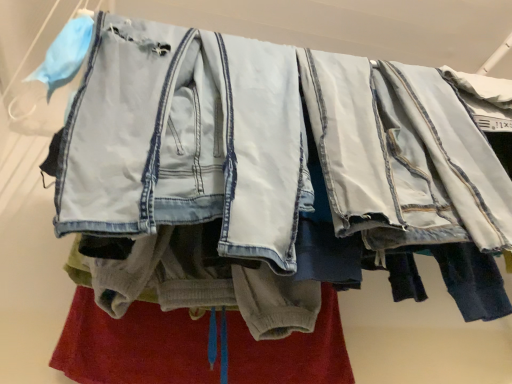
Locate an element on the screen. soft gray fleece pants at center is located at coordinates (133, 345).

What do you see at coordinates (133, 345) in the screenshot? I see `soft gray fleece pants at center` at bounding box center [133, 345].

The width and height of the screenshot is (512, 384). I want to click on light blue denim jacket at center, so click(x=186, y=140).

The height and width of the screenshot is (384, 512). What do you see at coordinates (186, 140) in the screenshot? I see `light blue denim jacket at center` at bounding box center [186, 140].

Identify the location of soft gray fleece pants at center. (133, 345).

Does soft gray fleece pants at center appear on the right side of light blue denim jacket at center?

Yes, soft gray fleece pants at center is to the right of light blue denim jacket at center.

Which is in front, soft gray fleece pants at center or light blue denim jacket at center?

Positioned in front is light blue denim jacket at center.

Is point (310, 354) behind point (139, 82)?

Yes.

From the image's perspective, is soft gray fleece pants at center on light blue denim jacket at center?

Incorrect, from the image's perspective, soft gray fleece pants at center is lower than light blue denim jacket at center.

From a real-world perspective, which object stands above the other?

In real-world perspective, light blue denim jacket at center is above.

Which of these two, soft gray fleece pants at center or light blue denim jacket at center, is wider?

Wider between the two is light blue denim jacket at center.

Consider the image. Is soft gray fleece pants at center taller than light blue denim jacket at center?

In fact, soft gray fleece pants at center may be shorter than light blue denim jacket at center.

In terms of size, does soft gray fleece pants at center appear bigger or smaller than light blue denim jacket at center?

In the image, soft gray fleece pants at center appears to be smaller than light blue denim jacket at center.

Can we say soft gray fleece pants at center lies outside light blue denim jacket at center?

Yes, soft gray fleece pants at center is not within light blue denim jacket at center.

Are soft gray fleece pants at center and light blue denim jacket at center far apart?

soft gray fleece pants at center is near light blue denim jacket at center, not far away.

Does soft gray fleece pants at center turn towards light blue denim jacket at center?

Yes, soft gray fleece pants at center is facing light blue denim jacket at center.

Can you tell me how much soft gray fleece pants at center and light blue denim jacket at center differ in facing direction?

They differ by 0.00281 degrees in their facing directions.

Find the location of `denim jacket above the soft gray fleece pants at center (from the image's perspective)`. denim jacket above the soft gray fleece pants at center (from the image's perspective) is located at coordinates (186, 140).

Considering the positions of objects light blue denim jacket at center and soft gray fleece pants at center in the image provided, who is more to the right, light blue denim jacket at center or soft gray fleece pants at center?

soft gray fleece pants at center.

Is light blue denim jacket at center positioned in front of soft gray fleece pants at center?

Yes, light blue denim jacket at center is in front of soft gray fleece pants at center.

Which is closer to the camera, (143, 189) or (197, 360)?

The point (143, 189) is more forward.

From the image's perspective, between light blue denim jacket at center and soft gray fleece pants at center, which one is located above?

light blue denim jacket at center.

From a real-world perspective, who is located lower, light blue denim jacket at center or soft gray fleece pants at center?

soft gray fleece pants at center, from a real-world perspective.

Between light blue denim jacket at center and soft gray fleece pants at center, which one has larger width?

light blue denim jacket at center.

Between light blue denim jacket at center and soft gray fleece pants at center, which one has less height?

With less height is soft gray fleece pants at center.

Between light blue denim jacket at center and soft gray fleece pants at center, which one has smaller size?

soft gray fleece pants at center.

Is soft gray fleece pants at center surrounded by light blue denim jacket at center?

Definitely not — soft gray fleece pants at center is not inside light blue denim jacket at center.

Is light blue denim jacket at center in contact with soft gray fleece pants at center?

No, light blue denim jacket at center is not beside soft gray fleece pants at center.

Is light blue denim jacket at center turned away from soft gray fleece pants at center?

Yes, light blue denim jacket at center is positioned with its back facing soft gray fleece pants at center.

What's the angular difference between light blue denim jacket at center and soft gray fleece pants at center's facing directions?

0.00281 degrees.

At what (x,y) coordinates should I click in order to perform the action: click on underclothes that appears below the light blue denim jacket at center (from a real-world perspective). Please return your answer as a coordinate pair (x, y). The image size is (512, 384). Looking at the image, I should click on (133, 345).

Where is `underclothes on the right side of light blue denim jacket at center`? The image size is (512, 384). underclothes on the right side of light blue denim jacket at center is located at coordinates (133, 345).

Where is `underclothes directly beneath the light blue denim jacket at center (from a real-world perspective)`? Image resolution: width=512 pixels, height=384 pixels. underclothes directly beneath the light blue denim jacket at center (from a real-world perspective) is located at coordinates (133, 345).